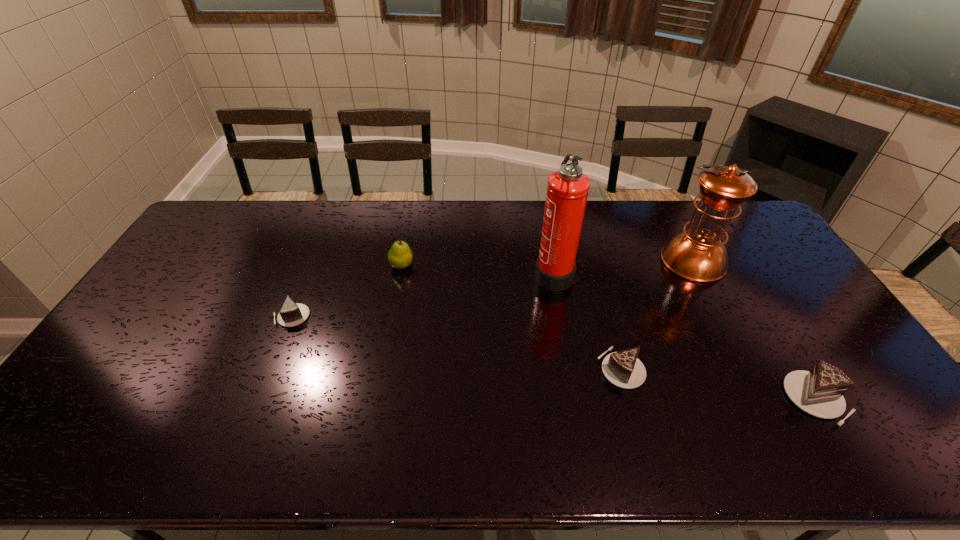
To ensure equal spacing by inserting another chocolate_cake among them, please point out a vacant spot for this new chocolate_cake. Please provide its 2D coordinates. Your answer should be formatted as a tuple, i.e. [(x, y)], where the tuple contains the x and y coordinates of a point satisfying the conditions above.

[(447, 341)]